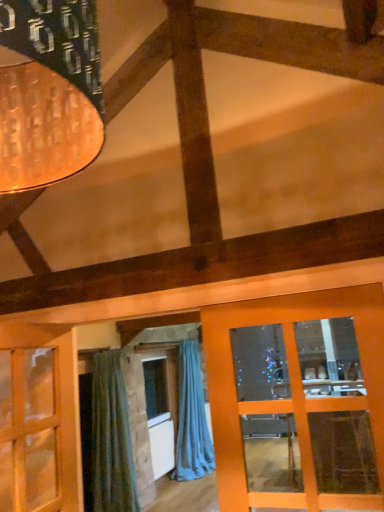
Question: From the image's perspective, is green fabric curtain at lower left, placed as the 2th curtain when sorted from back to front, positioned above or below blue fabric curtain at center, positioned as the first curtain in back-to-front order?

Choices:
 (A) above
 (B) below

Answer: (A)

Question: In terms of width, does green fabric curtain at lower left, positioned as the 2th curtain in right-to-left order, look wider or thinner when compared to blue fabric curtain at center, placed as the first curtain when sorted from right to left?

Choices:
 (A) thin
 (B) wide

Answer: (A)

Question: Is point (109, 377) closer or farther from the camera than point (205, 413)?

Choices:
 (A) farther
 (B) closer

Answer: (B)

Question: Considering the positions of point (205, 449) and point (117, 406), is point (205, 449) closer or farther from the camera than point (117, 406)?

Choices:
 (A) farther
 (B) closer

Answer: (A)

Question: Is blue fabric curtain at center, marked as the 2th curtain in a front-to-back arrangement, in front of or behind green fabric curtain at lower left, placed as the 2th curtain when sorted from back to front, in the image?

Choices:
 (A) behind
 (B) front

Answer: (A)

Question: From the image's perspective, is blue fabric curtain at center, positioned as the first curtain in back-to-front order, positioned above or below green fabric curtain at lower left, marked as the first curtain in a left-to-right arrangement?

Choices:
 (A) below
 (B) above

Answer: (A)

Question: Is blue fabric curtain at center, placed as the first curtain when sorted from right to left, inside or outside of green fabric curtain at lower left, marked as the first curtain in a left-to-right arrangement?

Choices:
 (A) inside
 (B) outside

Answer: (B)